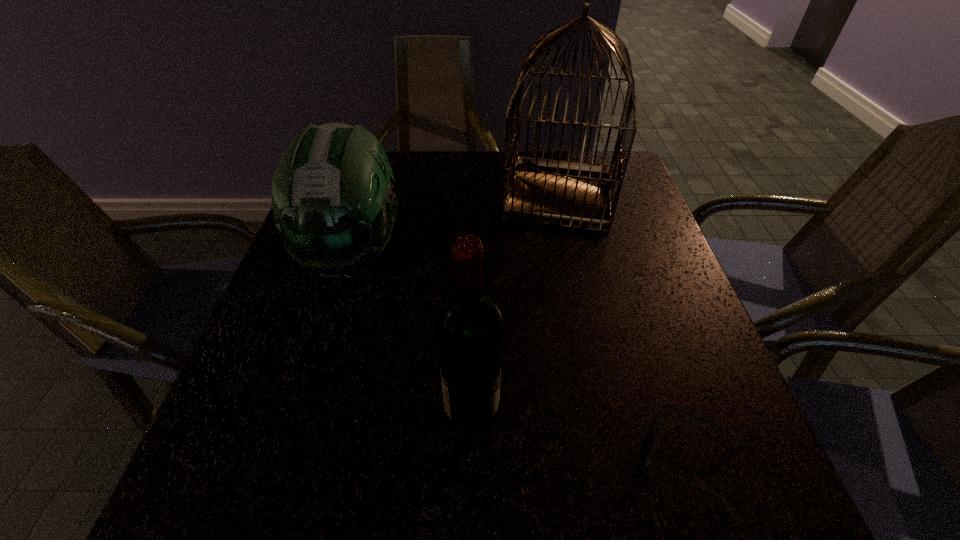
I want to click on free space located on the lenses of the sunglasses, so click(487, 458).

Identify the location of vacant space located on the lenses of the sunglasses. (467, 458).

At what (x,y) coordinates should I click in order to perform the action: click on object present at the far edge. Please return your answer as a coordinate pair (x, y). The width and height of the screenshot is (960, 540). Looking at the image, I should click on (573, 194).

The image size is (960, 540). I want to click on object located in the near edge section of the desktop, so click(x=659, y=420).

This screenshot has height=540, width=960. In order to click on object situated at the left edge in this screenshot , I will do `click(334, 206)`.

I want to click on birdcage situated at the right edge, so click(x=573, y=194).

Find the location of a particular element. sunglasses located at the right edge is located at coordinates [x=659, y=420].

The height and width of the screenshot is (540, 960). Identify the location of object that is positioned at the far right corner. [573, 194].

The width and height of the screenshot is (960, 540). What are the coordinates of `object positioned at the near right corner` in the screenshot? It's located at (659, 420).

At what (x,y) coordinates should I click in order to perform the action: click on free spot at the far edge of the desktop. Please return your answer as a coordinate pair (x, y). Looking at the image, I should click on (466, 193).